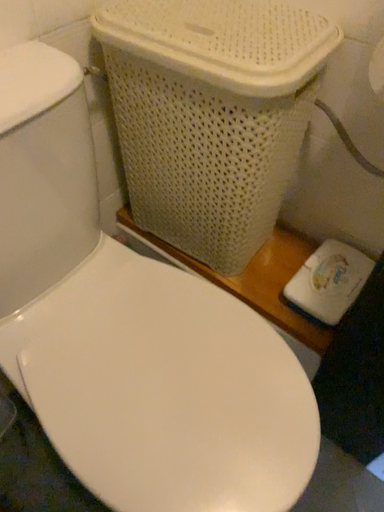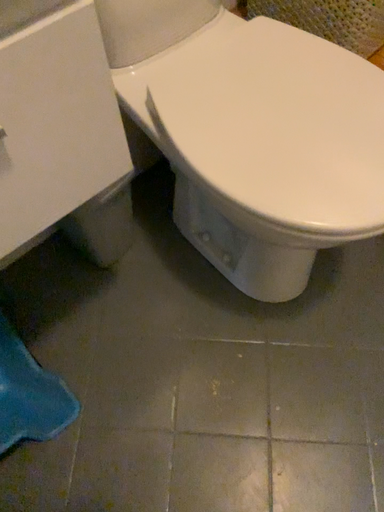
Question: How did the camera likely rotate when shooting the video?

Choices:
 (A) rotated right
 (B) rotated left

Answer: (B)